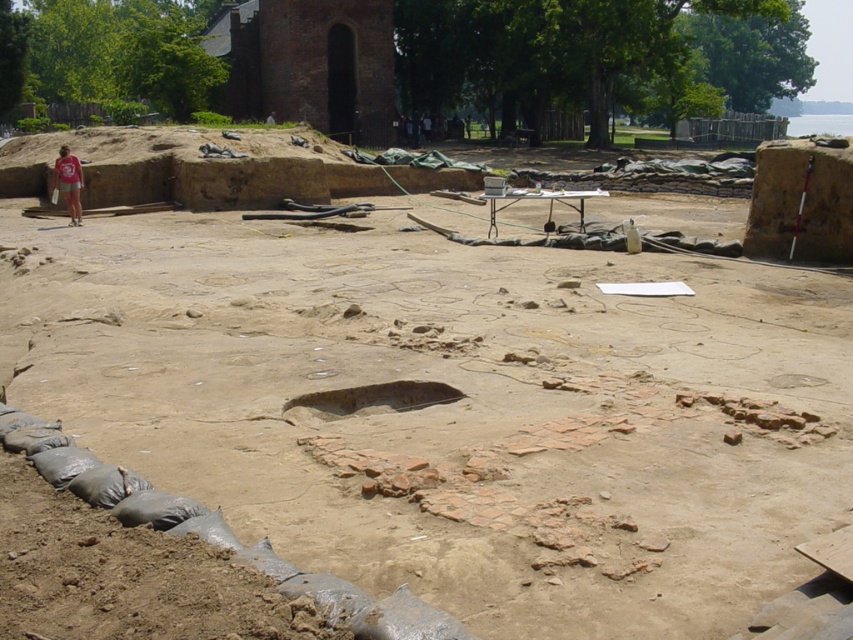
You are an archaeologist standing at the edge of the excavation site. You need to locate the brown sandy soil at center. Where exactly would you find it in terms of coordinates?

The brown sandy soil at center is located at coordinates point (451, 408).

You are an archaeologist working at the excavation site. You need to place a protective cover over the brown sandy soil at center and the matte pink shirt at left. Based on the scene description, which area requires a larger cover?

The brown sandy soil at center requires a larger cover because its width surpasses that of the matte pink shirt at left.

You are an archaeologist standing at the excavation site. You notice the brown sandy soil at center and the matte pink shirt at left. Which object is located to the right of the other?

The brown sandy soil at center is positioned on the right side of the matte pink shirt at left, so the brown sandy soil at center is to the right of the matte pink shirt at left.